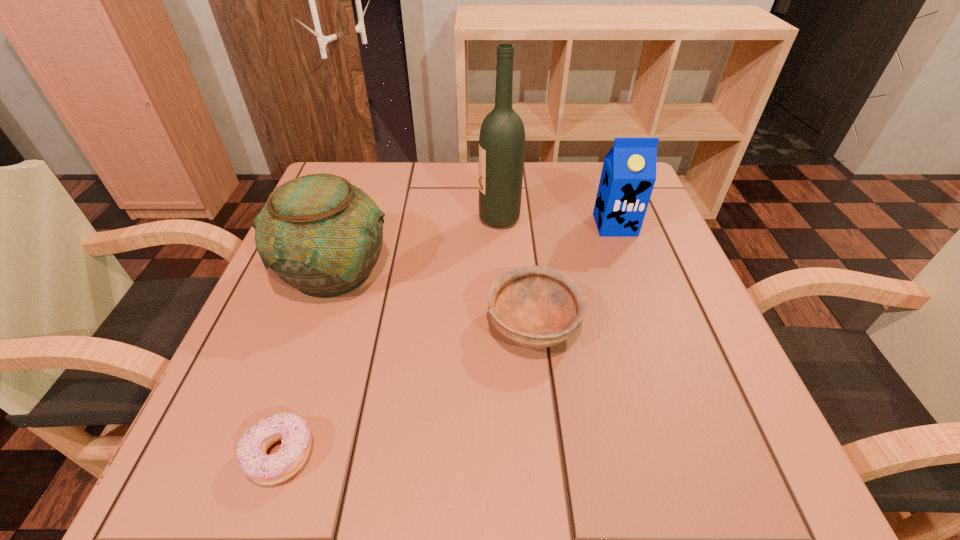
I want to click on wine bottle, so click(x=502, y=135).

I want to click on carton, so click(x=628, y=176).

You are a GUI agent. You are given a task and a screenshot of the screen. Output one action in this format:
    pyautogui.click(x=<x>, y=<y>)
    Task: Click on the pottery
    This screenshot has height=540, width=960.
    Given the screenshot: What is the action you would take?
    pyautogui.click(x=319, y=233)

Locate an element on the screen. The height and width of the screenshot is (540, 960). the fourth tallest object is located at coordinates (535, 307).

You are a GUI agent. You are given a task and a screenshot of the screen. Output one action in this format:
    pyautogui.click(x=<x>, y=<y>)
    Task: Click on the nearest object
    The height and width of the screenshot is (540, 960).
    Given the screenshot: What is the action you would take?
    pyautogui.click(x=293, y=430)

Locate an element on the screen. This screenshot has width=960, height=540. the shortest object is located at coordinates (293, 430).

Where is `vacant position located 0.220m on the labeled side of the tallest object`? This screenshot has height=540, width=960. vacant position located 0.220m on the labeled side of the tallest object is located at coordinates (379, 219).

Where is `vacant space situated 0.340m on the labeled side of the tallest object`? The height and width of the screenshot is (540, 960). vacant space situated 0.340m on the labeled side of the tallest object is located at coordinates (325, 219).

This screenshot has height=540, width=960. I want to click on vacant space located 0.210m on the labeled side of the tallest object, so click(384, 219).

Locate an element on the screen. The image size is (960, 540). free space located 0.130m with the cap open on the rightmost object is located at coordinates (635, 280).